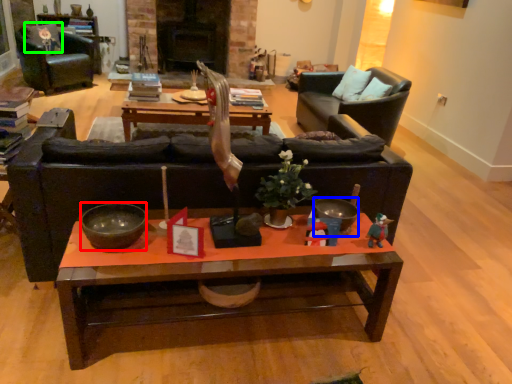
Question: Considering the real-world distances, which object is closest to bowl (highlighted by a red box)? bowl (highlighted by a blue box) or pillow (highlighted by a green box).

Choices:
 (A) bowl
 (B) pillow

Answer: (A)